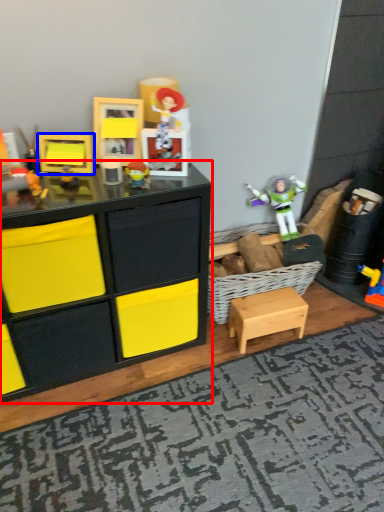
Question: Which object appears farthest to the camera in this image, chest of drawers (highlighted by a red box) or toy (highlighted by a blue box)?

Choices:
 (A) chest of drawers
 (B) toy

Answer: (B)